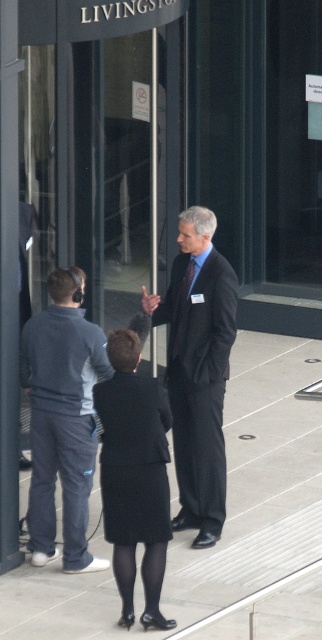
Question: Estimate the real-world distances between objects in this image. Which object is farther from the dark suit at center?

Choices:
 (A) dark gray fleece jacket at left
 (B) black fabric skirt at center

Answer: (B)

Question: Does dark suit at center appear under dark gray fleece jacket at left?

Choices:
 (A) no
 (B) yes

Answer: (A)

Question: Which object is closer to the camera taking this photo?

Choices:
 (A) black fabric skirt at center
 (B) dark gray fleece jacket at left

Answer: (A)

Question: Which point is closer to the camera?

Choices:
 (A) dark suit at center
 (B) dark gray fleece jacket at left
 (C) black fabric skirt at center

Answer: (C)

Question: Does dark suit at center appear on the left side of black fabric skirt at center?

Choices:
 (A) no
 (B) yes

Answer: (A)

Question: Is dark suit at center further to the viewer compared to dark gray fleece jacket at left?

Choices:
 (A) yes
 (B) no

Answer: (A)